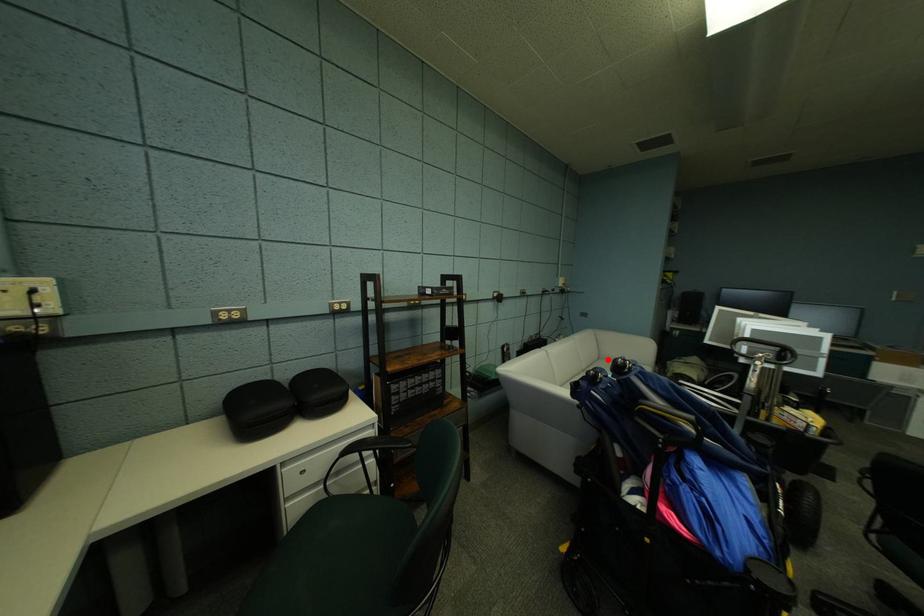
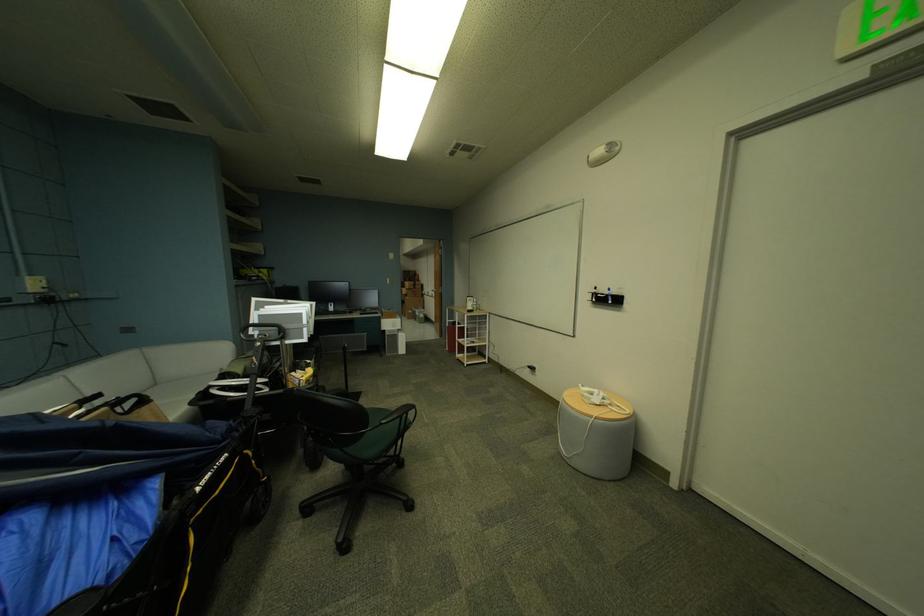
Question: I am providing you with two images of the same scene from different viewpoints. Image1 has a red point marked. In image2, the corresponding 3D location appears at what relative position? Reply with the corresponding letter.

Choices:
 (A) Closer
 (B) Farther

Answer: (A)